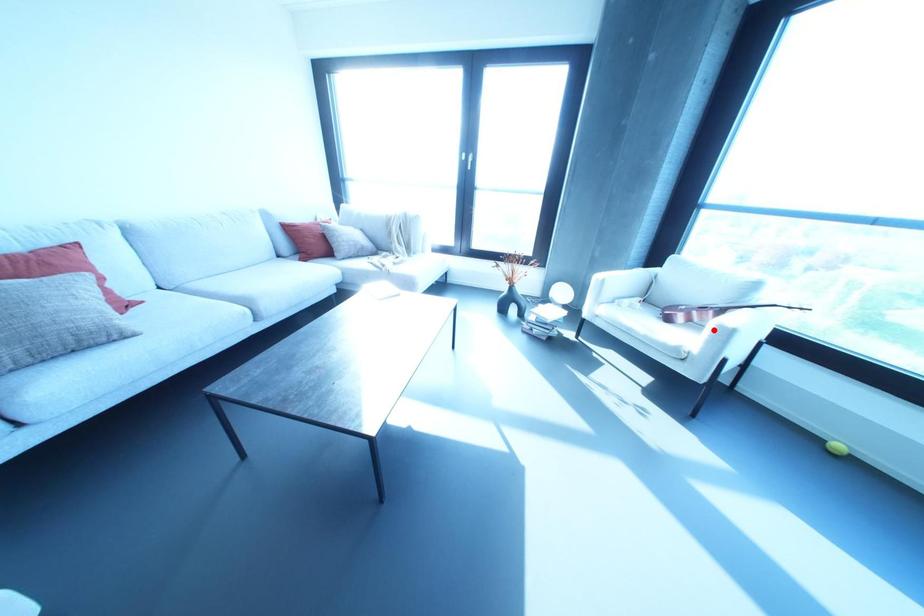
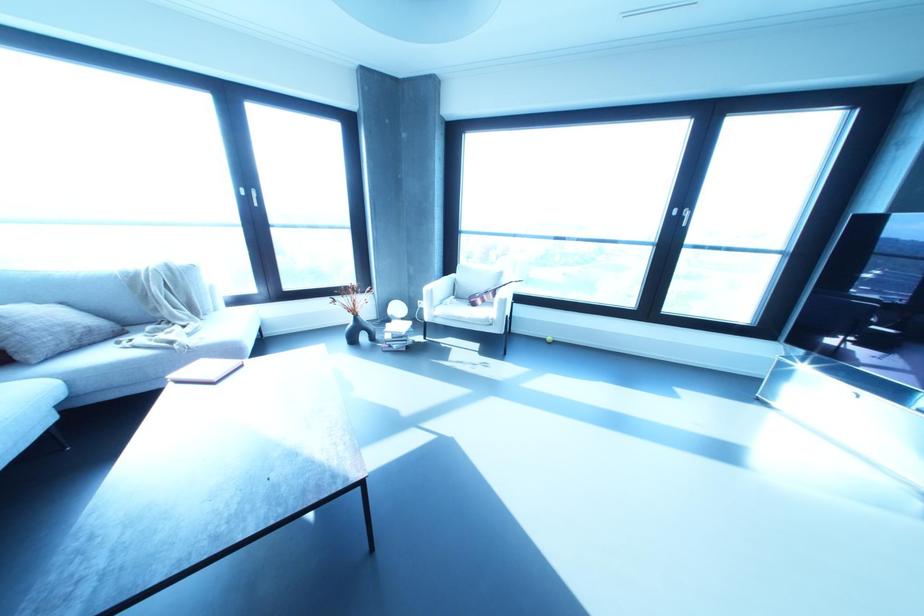
Question: I am providing you with two images of the same scene from different viewpoints. Given a red point in image1, look at the same physical point in image2. Is it:

Choices:
 (A) Closer to the viewpoint
 (B) Farther from the viewpoint

Answer: (B)